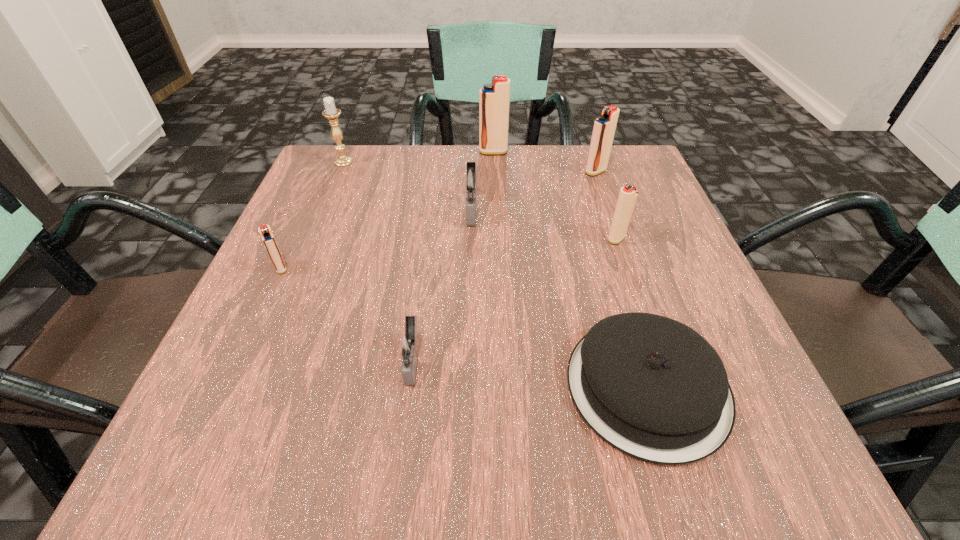
Locate which igniter ranks fourth in proximity to the leftmost igniter. Please provide its 2D coordinates. Your answer should be formatted as a tuple, i.e. [(x, y)], where the tuple contains the x and y coordinates of a point satisfying the conditions above.

[(628, 194)]

This screenshot has width=960, height=540. I want to click on red igniter that is the second closest to the shortest object, so click(x=604, y=127).

Locate an element on the screen. This screenshot has width=960, height=540. red igniter that stands as the closest to the second smallest red igniter is located at coordinates (604, 127).

The height and width of the screenshot is (540, 960). In order to click on vacant area in the image that satisfies the following two spatial constraints: 1. on the back side of the smaller gray igniter; 2. on the left side of the third farthest red igniter in this screenshot , I will do `click(428, 239)`.

This screenshot has height=540, width=960. I want to click on free point that satisfies the following two spatial constraints: 1. on the front side of the candle holder; 2. on the left side of the second igniter from left to right, so click(x=260, y=361).